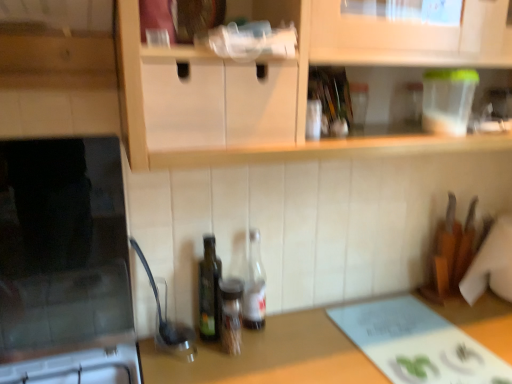
You are a GUI agent. You are given a task and a screenshot of the screen. Output one action in this format:
    pyautogui.click(x=<x>, y=<y>)
    Task: Click on the vacant region in front of translucent glass spice jar at center, which is the second bottle in left-to-right order
    This screenshot has height=384, width=512.
    Given the screenshot: What is the action you would take?
    click(227, 371)